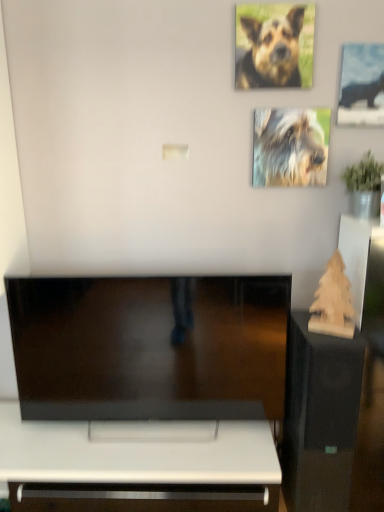
Question: Is metallic silver hippo at upper right aimed at wooden christmas tree at right?

Choices:
 (A) yes
 (B) no

Answer: (B)

Question: Considering the relative sizes of metallic silver hippo at upper right and wooden christmas tree at right in the image provided, is metallic silver hippo at upper right smaller than wooden christmas tree at right?

Choices:
 (A) no
 (B) yes

Answer: (B)

Question: Is metallic silver hippo at upper right to the left of wooden christmas tree at right from the viewer's perspective?

Choices:
 (A) no
 (B) yes

Answer: (A)

Question: Can you confirm if metallic silver hippo at upper right is shorter than wooden christmas tree at right?

Choices:
 (A) no
 (B) yes

Answer: (A)

Question: Can you see metallic silver hippo at upper right touching wooden christmas tree at right?

Choices:
 (A) yes
 (B) no

Answer: (B)

Question: Is wooden christmas tree at right at the back of metallic silver hippo at upper right?

Choices:
 (A) no
 (B) yes

Answer: (A)

Question: Is brown fur dog at upper right, which is the 1th dog from top to bottom, positioned behind metallic silver hippo at upper right?

Choices:
 (A) yes
 (B) no

Answer: (B)

Question: Does brown fur dog at upper right, arranged as the second dog when ordered from the bottom, have a greater height compared to metallic silver hippo at upper right?

Choices:
 (A) no
 (B) yes

Answer: (A)

Question: From the image's perspective, is brown fur dog at upper right, arranged as the second dog when ordered from the bottom, located above metallic silver hippo at upper right?

Choices:
 (A) yes
 (B) no

Answer: (A)

Question: Is brown fur dog at upper right, the 2th dog in the back-to-front sequence, oriented away from metallic silver hippo at upper right?

Choices:
 (A) yes
 (B) no

Answer: (B)

Question: Is brown fur dog at upper right, positioned as the first dog in front-to-back order, placed right next to metallic silver hippo at upper right?

Choices:
 (A) no
 (B) yes

Answer: (A)

Question: From the image's perspective, is brown fur dog at upper right, which is the 1th dog from top to bottom, located beneath metallic silver hippo at upper right?

Choices:
 (A) yes
 (B) no

Answer: (B)

Question: Is wooden sculpture at right not within brown fur dog at upper right, which is the 1th dog from top to bottom?

Choices:
 (A) yes
 (B) no

Answer: (A)